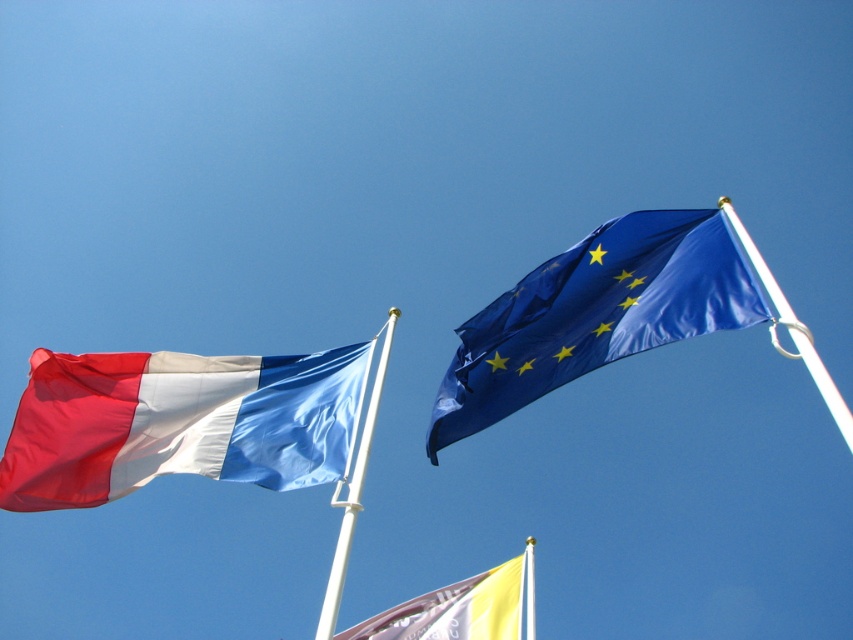
Question: Is matte fabric flag at left wider than white plastic flag pole at left?

Choices:
 (A) yes
 (B) no

Answer: (B)

Question: Which of the following is the farthest from the observer?

Choices:
 (A) (341, 579)
 (B) (247, 362)

Answer: (B)

Question: Is white plastic flag pole at left to the right of white plastic flag pole at upper right from the viewer's perspective?

Choices:
 (A) yes
 (B) no

Answer: (B)

Question: In this image, where is yellow fabric flag at lower center located relative to white plastic flag pole at left?

Choices:
 (A) left
 (B) right

Answer: (B)

Question: Which object appears farthest from the camera in this image?

Choices:
 (A) matte fabric flag at left
 (B) white plastic flag pole at lower center
 (C) blue glossy flag at upper right

Answer: (B)

Question: Considering the real-world distances, which object is closest to the white plastic flag pole at lower center?

Choices:
 (A) white plastic flag pole at left
 (B) yellow fabric flag at lower center
 (C) matte fabric flag at left

Answer: (B)